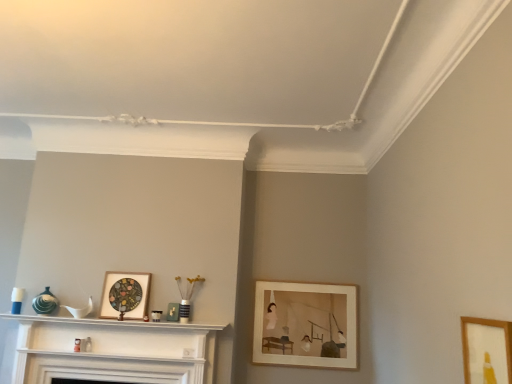
In order to face white glossy fireplace at center, should I rotate leftwards or rightwards?

You should look left and rotate roughly 18.520 degrees.

You are a GUI agent. You are given a task and a screenshot of the screen. Output one action in this format:
    pyautogui.click(x=<x>, y=<y>)
    Task: Click on the wooden picture frame at lower right, which is the first picture frame in front-to-back order
    The height and width of the screenshot is (384, 512).
    Given the screenshot: What is the action you would take?
    pyautogui.click(x=486, y=350)

Locate an element on the screen. Image resolution: width=512 pixels, height=384 pixels. wooden stained picture frame at center, the second picture frame from the back is located at coordinates (125, 294).

Is wooden picture frame at lower right, which is counted as the third picture frame, starting from the left, positioned with its back to wooden stained picture frame at center, the second picture frame from the back?

No, wooden picture frame at lower right, which is counted as the third picture frame, starting from the left, is not facing away from wooden stained picture frame at center, the second picture frame from the back.

Is wooden picture frame at lower right, which is the first picture frame in front-to-back order, not within wooden stained picture frame at center, marked as the first picture frame in a left-to-right arrangement?

wooden picture frame at lower right, which is the first picture frame in front-to-back order, lies outside wooden stained picture frame at center, marked as the first picture frame in a left-to-right arrangement,'s area.

In the image, is wooden picture frame at lower right, placed as the third picture frame when sorted from back to front, positioned in front of or behind wooden stained picture frame at center, marked as the first picture frame in a left-to-right arrangement?

wooden picture frame at lower right, placed as the third picture frame when sorted from back to front, is in front of wooden stained picture frame at center, marked as the first picture frame in a left-to-right arrangement.

Is point (502, 347) less distant than point (304, 297)?

Yes, point (502, 347) is in front of point (304, 297).

From the image's perspective, which one is positioned higher, wooden picture frame at lower right, placed as the third picture frame when sorted from back to front, or wooden picture frame at center-right, the first picture frame when ordered from back to front?

wooden picture frame at lower right, placed as the third picture frame when sorted from back to front, is shown above in the image.

Is wooden picture frame at lower right, which is counted as the third picture frame, starting from the left, far from wooden picture frame at center-right, acting as the 3th picture frame starting from the front?

Absolutely, wooden picture frame at lower right, which is counted as the third picture frame, starting from the left, is distant from wooden picture frame at center-right, acting as the 3th picture frame starting from the front.

Is wooden picture frame at lower right, which is the first picture frame in front-to-back order, located outside wooden picture frame at center-right, the first picture frame when ordered from back to front?

wooden picture frame at lower right, which is the first picture frame in front-to-back order, is positioned outside wooden picture frame at center-right, the first picture frame when ordered from back to front.

Is wooden picture frame at center-right, acting as the 3th picture frame starting from the front, at the left side of wooden picture frame at lower right, which is counted as the 1th picture frame, starting from the right?

Correct, you'll find wooden picture frame at center-right, acting as the 3th picture frame starting from the front, to the left of wooden picture frame at lower right, which is counted as the 1th picture frame, starting from the right.

Consider the image. Does wooden picture frame at center-right, the first picture frame when ordered from back to front, have a lesser width compared to wooden picture frame at lower right, which is the first picture frame in front-to-back order?

Incorrect, the width of wooden picture frame at center-right, the first picture frame when ordered from back to front, is not less than that of wooden picture frame at lower right, which is the first picture frame in front-to-back order.

Is point (340, 318) farther from viewer compared to point (482, 366)?

That is True.

Is wooden picture frame at center-right, which ranks as the second picture frame in left-to-right order, facing away from wooden stained picture frame at center, the second picture frame from the back?

No.

Is wooden picture frame at center-right, the first picture frame when ordered from back to front, further to camera compared to wooden stained picture frame at center, marked as the first picture frame in a left-to-right arrangement?

Yes, the depth of wooden picture frame at center-right, the first picture frame when ordered from back to front, is greater than that of wooden stained picture frame at center, marked as the first picture frame in a left-to-right arrangement.

Based on their sizes in the image, would you say wooden picture frame at center-right, which ranks as the second picture frame in left-to-right order, is bigger or smaller than wooden stained picture frame at center, marked as the first picture frame in a left-to-right arrangement?

wooden picture frame at center-right, which ranks as the second picture frame in left-to-right order, is bigger than wooden stained picture frame at center, marked as the first picture frame in a left-to-right arrangement.

Is wooden picture frame at center-right, the 2th picture frame from the right, wider than wooden stained picture frame at center, placed as the 3th picture frame when sorted from right to left?

No.

Are white glossy fireplace at center and wooden picture frame at lower right, which is the first picture frame in front-to-back order, located far from each other?

Yes, white glossy fireplace at center and wooden picture frame at lower right, which is the first picture frame in front-to-back order, are located far from each other.

From a real-world perspective, is white glossy fireplace at center physically above wooden picture frame at lower right, which is counted as the third picture frame, starting from the left?

No, from a real-world perspective, white glossy fireplace at center is not above wooden picture frame at lower right, which is counted as the third picture frame, starting from the left.

Considering the sizes of objects white glossy fireplace at center and wooden picture frame at lower right, which is the first picture frame in front-to-back order, in the image provided, who is bigger, white glossy fireplace at center or wooden picture frame at lower right, which is the first picture frame in front-to-back order,?

With larger size is white glossy fireplace at center.

From a real-world perspective, which object rests below the other?

From a 3D spatial view, white glossy fireplace at center is below.

Can you tell me how much white glossy fireplace at center and wooden stained picture frame at center, marked as the first picture frame in a left-to-right arrangement, differ in facing direction?

There is a 1.56-degree angle between the facing directions of white glossy fireplace at center and wooden stained picture frame at center, marked as the first picture frame in a left-to-right arrangement.

Consider the image. From the image's perspective, is white glossy fireplace at center positioned above or below wooden stained picture frame at center, placed as the 3th picture frame when sorted from right to left?

white glossy fireplace at center is below wooden stained picture frame at center, placed as the 3th picture frame when sorted from right to left.

Which object is more forward, white glossy fireplace at center or wooden stained picture frame at center, the second picture frame from the back?

white glossy fireplace at center is in front.

Is white glossy fireplace at center positioned far away from wooden picture frame at center-right, which ranks as the second picture frame in left-to-right order?

white glossy fireplace at center is actually quite close to wooden picture frame at center-right, which ranks as the second picture frame in left-to-right order.

Considering their positions, is white glossy fireplace at center located in front of or behind wooden picture frame at center-right, acting as the 3th picture frame starting from the front?

Clearly, white glossy fireplace at center is in front of wooden picture frame at center-right, acting as the 3th picture frame starting from the front.

The width and height of the screenshot is (512, 384). I want to click on shelf that appears in front of the wooden picture frame at center-right, which ranks as the second picture frame in left-to-right order, so click(x=113, y=350).

Locate an element on the screen. picture frame in front of the wooden stained picture frame at center, placed as the 3th picture frame when sorted from right to left is located at coordinates (486, 350).

From the image's perspective, starting from the wooden picture frame at center-right, the 2th picture frame from the right, which picture frame is the 2nd one above? Please provide its 2D coordinates.

[(486, 350)]

From the image, which object appears to be nearer to white glossy fireplace at center, wooden picture frame at lower right, which is counted as the 1th picture frame, starting from the right, or wooden picture frame at center-right, the 2th picture frame from the right?

wooden picture frame at center-right, the 2th picture frame from the right, is closer to white glossy fireplace at center.

Estimate the real-world distances between objects in this image. Which object is closer to white glossy fireplace at center, wooden picture frame at center-right, acting as the 3th picture frame starting from the front, or wooden stained picture frame at center, marked as the first picture frame in a left-to-right arrangement?

The object closer to white glossy fireplace at center is wooden stained picture frame at center, marked as the first picture frame in a left-to-right arrangement.

From the image, which object appears to be farther from wooden picture frame at center-right, which ranks as the second picture frame in left-to-right order, wooden picture frame at lower right, placed as the third picture frame when sorted from back to front, or wooden stained picture frame at center, the second picture frame from the back?

Based on the image, wooden picture frame at lower right, placed as the third picture frame when sorted from back to front, appears to be further to wooden picture frame at center-right, which ranks as the second picture frame in left-to-right order.

When comparing their distances from wooden picture frame at center-right, acting as the 3th picture frame starting from the front, does white glossy fireplace at center or wooden stained picture frame at center, placed as the 3th picture frame when sorted from right to left, seem closer?

white glossy fireplace at center lies closer to wooden picture frame at center-right, acting as the 3th picture frame starting from the front, than the other object.

Considering their positions, is wooden picture frame at lower right, placed as the third picture frame when sorted from back to front, positioned further to wooden stained picture frame at center, the second picture frame from the back, than wooden picture frame at center-right, the first picture frame when ordered from back to front?

wooden picture frame at lower right, placed as the third picture frame when sorted from back to front.

Looking at the image, which one is located further to white glossy fireplace at center, wooden stained picture frame at center, the 2th picture frame in the front-to-back sequence, or wooden picture frame at center-right, which ranks as the second picture frame in left-to-right order?

wooden picture frame at center-right, which ranks as the second picture frame in left-to-right order.

Which object lies further to the anchor point wooden picture frame at lower right, which is the first picture frame in front-to-back order, white glossy fireplace at center or wooden picture frame at center-right, which ranks as the second picture frame in left-to-right order?

white glossy fireplace at center.

Which object lies further to the anchor point wooden stained picture frame at center, marked as the first picture frame in a left-to-right arrangement, wooden picture frame at center-right, acting as the 3th picture frame starting from the front, or wooden picture frame at lower right, which is the first picture frame in front-to-back order?

The object further to wooden stained picture frame at center, marked as the first picture frame in a left-to-right arrangement, is wooden picture frame at lower right, which is the first picture frame in front-to-back order.

This screenshot has height=384, width=512. Identify the location of picture frame between white glossy fireplace at center and wooden picture frame at center-right, the 2th picture frame from the right. (125, 294).

Where is `shelf between wooden picture frame at lower right, which is counted as the 1th picture frame, starting from the right, and wooden picture frame at center-right, the first picture frame when ordered from back to front, along the z-axis`? The width and height of the screenshot is (512, 384). shelf between wooden picture frame at lower right, which is counted as the 1th picture frame, starting from the right, and wooden picture frame at center-right, the first picture frame when ordered from back to front, along the z-axis is located at coordinates (113, 350).

The width and height of the screenshot is (512, 384). Find the location of `picture frame between wooden picture frame at lower right, placed as the third picture frame when sorted from back to front, and wooden picture frame at center-right, the first picture frame when ordered from back to front, from front to back`. picture frame between wooden picture frame at lower right, placed as the third picture frame when sorted from back to front, and wooden picture frame at center-right, the first picture frame when ordered from back to front, from front to back is located at coordinates (125, 294).